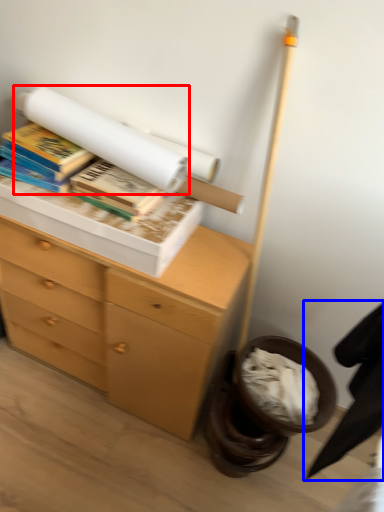
Question: Which point is further to the camera, book (highlighted by a red box) or swivel chair (highlighted by a blue box)?

Choices:
 (A) book
 (B) swivel chair

Answer: (A)